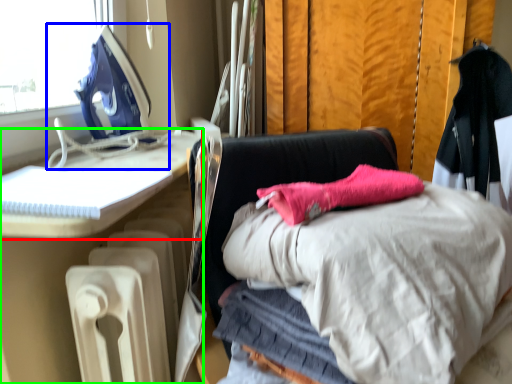
Question: Estimate the real-world distances between objects in this image. Which object is closer to furniture (highlighted by a red box), sewing machine (highlighted by a blue box) or furniture (highlighted by a green box)?

Choices:
 (A) sewing machine
 (B) furniture

Answer: (B)